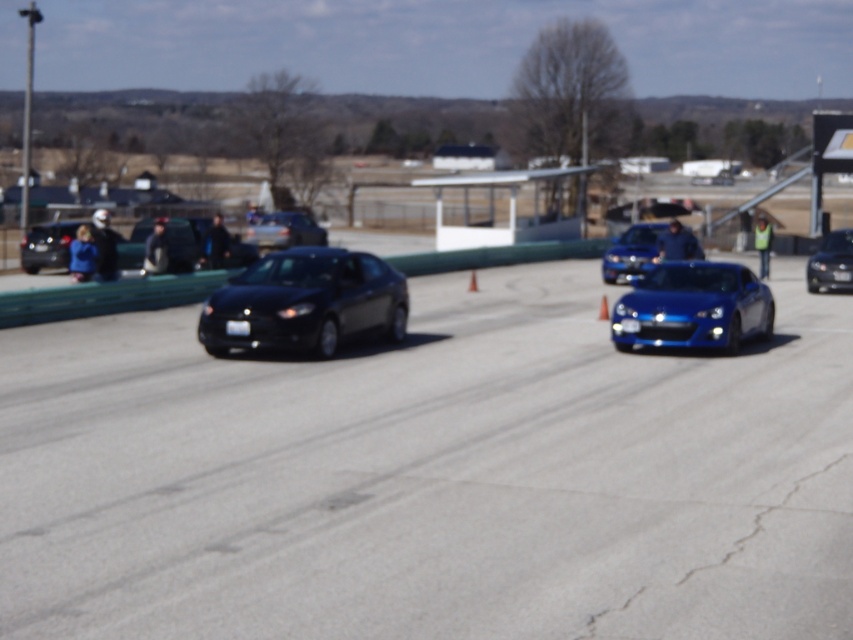
Between satin black sedan at center and shiny black car at right, which one appears on the right side from the viewer's perspective?

shiny black car at right is more to the right.

Does satin black sedan at center have a smaller size compared to shiny black car at right?

Incorrect, satin black sedan at center is not smaller in size than shiny black car at right.

Does point (294, 225) lie behind point (845, 257)?

Yes, point (294, 225) is behind point (845, 257).

This screenshot has width=853, height=640. I want to click on satin black sedan at center, so click(x=283, y=230).

Does shiny metallic sports car at right have a lesser height compared to satin black sedan at center?

Yes, shiny metallic sports car at right is shorter than satin black sedan at center.

Does shiny metallic sports car at right appear under satin black sedan at center?

Indeed, shiny metallic sports car at right is positioned under satin black sedan at center.

Image resolution: width=853 pixels, height=640 pixels. What are the coordinates of `shiny metallic sports car at right` in the screenshot? It's located at (693, 307).

Between glossy blue sports car at center and satin black sedan at center, which one appears on the left side from the viewer's perspective?

Positioned to the left is satin black sedan at center.

How distant is glossy blue sports car at center from satin black sedan at center?

glossy blue sports car at center is 14.98 meters away from satin black sedan at center.

Measure the distance between point (601,272) and camera.

Point (601,272) is 35.85 meters from camera.

At what (x,y) coordinates should I click in order to perform the action: click on glossy blue sports car at center. Please return your answer as a coordinate pair (x, y). Looking at the image, I should click on (631, 250).